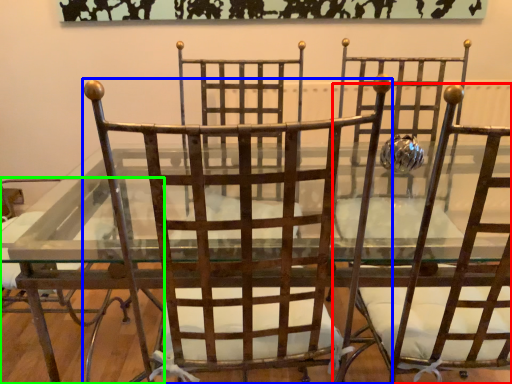
Question: Which object is positioned farthest from chair (highlighted by a red box)? Select from chair (highlighted by a blue box) and chair (highlighted by a green box).

Choices:
 (A) chair
 (B) chair

Answer: (B)